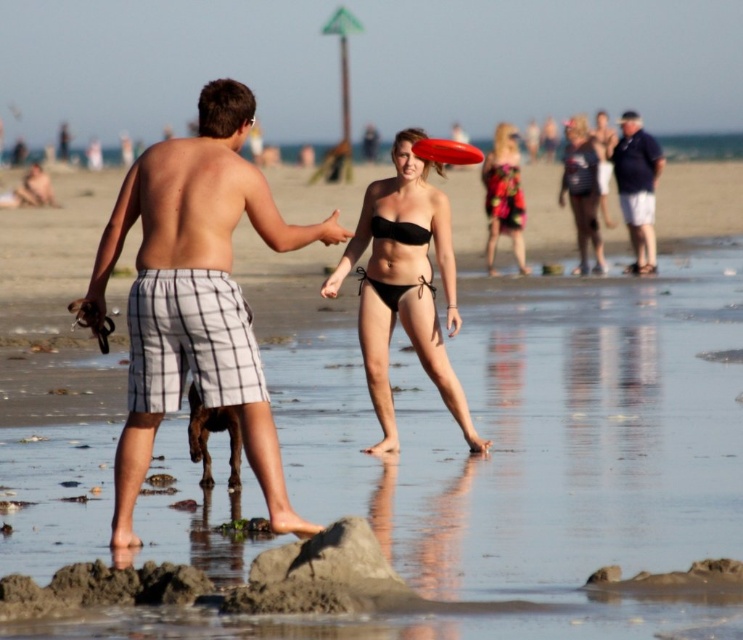
Who is more forward, (412, 148) or (415, 241)?

Point (415, 241) is more forward.

Between red plastic frisbee at center and black matte bikini top at center, which one has more height?

With more height is red plastic frisbee at center.

This screenshot has height=640, width=743. What are the coordinates of `red plastic frisbee at center` in the screenshot? It's located at (447, 150).

From the picture: Does black bikini at upper center have a greater width compared to dark blue shirt at upper right?

Yes, black bikini at upper center is wider than dark blue shirt at upper right.

Where is `black bikini at upper center`? black bikini at upper center is located at coordinates (585, 186).

Which is behind, point (428, 196) or point (467, 144)?

The point (467, 144) is more distant.

What are the coordinates of `black bikini at center` in the screenshot? It's located at (405, 289).

Who is more distant from viewer, (467, 445) or (464, 154)?

The point (464, 154) is more distant.

Where is `black bikini at center`? This screenshot has height=640, width=743. black bikini at center is located at coordinates (405, 289).